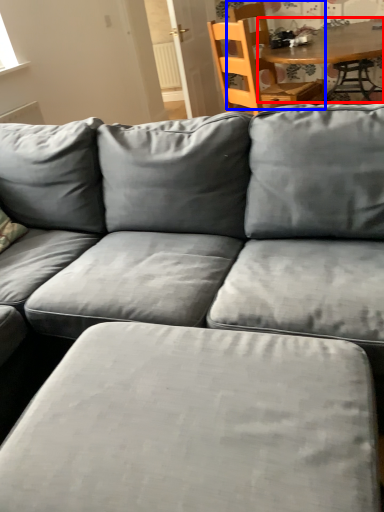
Question: Which object appears closest to the camera in this image, table (highlighted by a red box) or chair (highlighted by a blue box)?

Choices:
 (A) table
 (B) chair

Answer: (A)